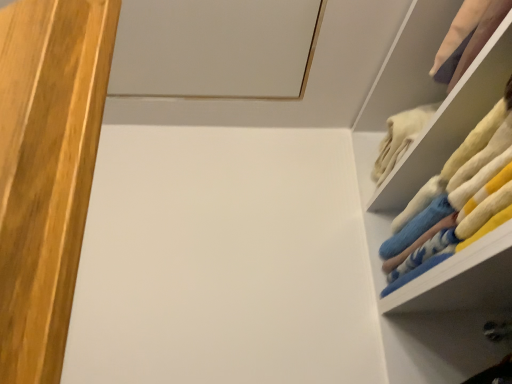
Find the location of `fluffy fabric socks at right`. fluffy fabric socks at right is located at coordinates (457, 200).

The image size is (512, 384). Describe the element at coordinates (457, 200) in the screenshot. I see `fluffy fabric socks at right` at that location.

What do you see at coordinates (450, 122) in the screenshot? The height and width of the screenshot is (384, 512). I see `white fluffy towels at upper right` at bounding box center [450, 122].

Measure the distance between white fluffy towels at upper right and camera.

They are 25.82 inches apart.

Locate an element on the screen. The image size is (512, 384). white fluffy towels at upper right is located at coordinates (450, 122).

Find the location of a particular element. The width and height of the screenshot is (512, 384). fluffy fabric socks at right is located at coordinates (457, 200).

Which object is positioned more to the left, fluffy fabric socks at right or white fluffy towels at upper right?

From the viewer's perspective, white fluffy towels at upper right appears more on the left side.

Looking at this image, which is in front, fluffy fabric socks at right or white fluffy towels at upper right?

fluffy fabric socks at right is more forward.

Which is less distant, [460,154] or [447,97]?

Point [460,154] appears to be closer to the viewer than point [447,97].

From the image's perspective, is fluffy fabric socks at right above white fluffy towels at upper right?

No, from the image's perspective, fluffy fabric socks at right is not over white fluffy towels at upper right.

From a real-world perspective, is fluffy fabric socks at right located beneath white fluffy towels at upper right?

Indeed, from a real-world perspective, fluffy fabric socks at right is positioned beneath white fluffy towels at upper right.

Is fluffy fabric socks at right wider than white fluffy towels at upper right?

No.

Who is shorter, fluffy fabric socks at right or white fluffy towels at upper right?

Standing shorter between the two is white fluffy towels at upper right.

Which of these two, fluffy fabric socks at right or white fluffy towels at upper right, is bigger?

With larger size is fluffy fabric socks at right.

Can we say fluffy fabric socks at right lies outside white fluffy towels at upper right?

Yes, fluffy fabric socks at right is not within white fluffy towels at upper right.

Is fluffy fabric socks at right not close to white fluffy towels at upper right?

No, fluffy fabric socks at right is not far away from white fluffy towels at upper right.

Is fluffy fabric socks at right facing towards white fluffy towels at upper right?

No, fluffy fabric socks at right does not turn towards white fluffy towels at upper right.

Can you tell me how much fluffy fabric socks at right and white fluffy towels at upper right differ in facing direction?

0.00575 degrees.

I want to click on cabinet located above the fluffy fabric socks at right (from a real-world perspective), so click(450, 122).

Between white fluffy towels at upper right and fluffy fabric socks at right, which one appears on the left side from the viewer's perspective?

white fluffy towels at upper right is more to the left.

Does white fluffy towels at upper right lie in front of fluffy fabric socks at right?

No, the depth of white fluffy towels at upper right is greater than that of fluffy fabric socks at right.

Which point is more forward, [438,142] or [434,257]?

The point [434,257] is closer to the camera.

From the image's perspective, would you say white fluffy towels at upper right is positioned over fluffy fabric socks at right?

Yes, from the image's perspective, white fluffy towels at upper right is above fluffy fabric socks at right.

From a real-world perspective, is white fluffy towels at upper right below fluffy fabric socks at right?

No.

Looking at this image, between white fluffy towels at upper right and fluffy fabric socks at right, which one has larger width?

With larger width is white fluffy towels at upper right.

Considering the sizes of objects white fluffy towels at upper right and fluffy fabric socks at right in the image provided, who is shorter, white fluffy towels at upper right or fluffy fabric socks at right?

white fluffy towels at upper right.

Can you confirm if white fluffy towels at upper right is bigger than fluffy fabric socks at right?

No.

Do you think white fluffy towels at upper right is within fluffy fabric socks at right, or outside of it?

white fluffy towels at upper right exists outside the volume of fluffy fabric socks at right.

Is white fluffy towels at upper right next to fluffy fabric socks at right and touching it?

No, white fluffy towels at upper right is not making contact with fluffy fabric socks at right.

Looking at this image, is white fluffy towels at upper right facing away from fluffy fabric socks at right?

That's not correct — white fluffy towels at upper right is not looking away from fluffy fabric socks at right.

How distant is white fluffy towels at upper right from fluffy fabric socks at right?

white fluffy towels at upper right and fluffy fabric socks at right are 4.97 inches apart from each other.

Locate an element on the screen. Image resolution: width=512 pixels, height=384 pixels. cabinet above the fluffy fabric socks at right (from the image's perspective) is located at coordinates (450, 122).

This screenshot has width=512, height=384. Identify the location of cabinet behind the fluffy fabric socks at right. (450, 122).

You are a GUI agent. You are given a task and a screenshot of the screen. Output one action in this format:
    pyautogui.click(x=<x>, y=<y>)
    Task: Click on the laundry on the right of the white fluffy towels at upper right
    
    Given the screenshot: What is the action you would take?
    pyautogui.click(x=457, y=200)